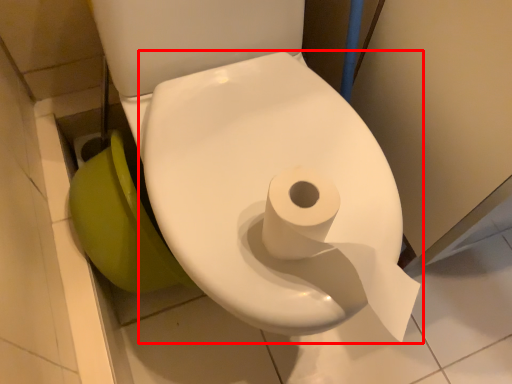
Question: Observing the image, what is the correct spatial positioning of toilet (annotated by the red box) in reference to toilet bowl?

Choices:
 (A) left
 (B) right

Answer: (B)